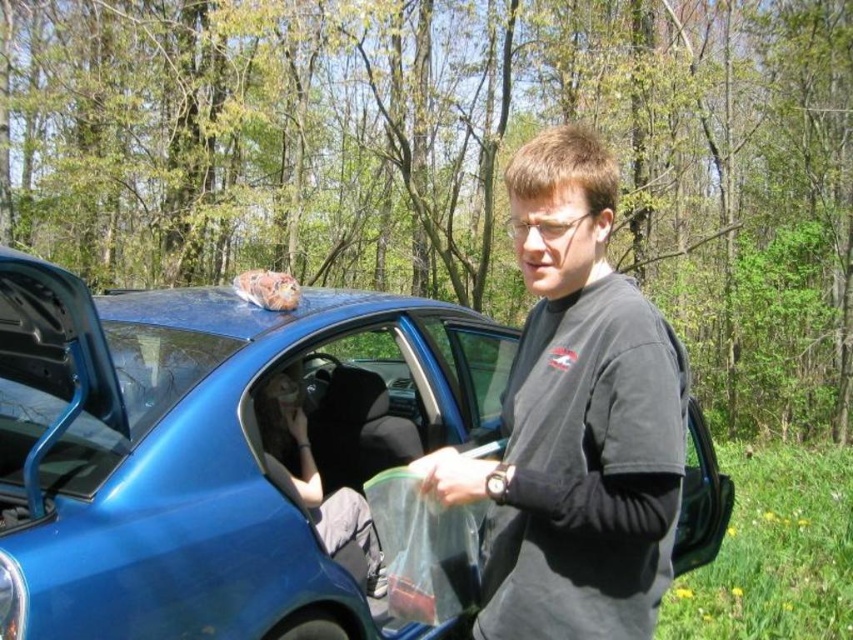
You are a delivery person trying to determine if there is enough space between the blue metallic car at center and the black matte shirt at center to maneuver your delivery cart through. Can you fit your cart between them?

The blue metallic car at center is larger in size than black matte shirt at center, so there might be sufficient space to maneuver your delivery cart between them. However, the exact distance isn not specified, so caution is advised.

You are a pedestrian standing in front of the blue metallic car at center and the black matte shirt at center. Which object is taller?

The blue metallic car at center is taller than the black matte shirt at center.